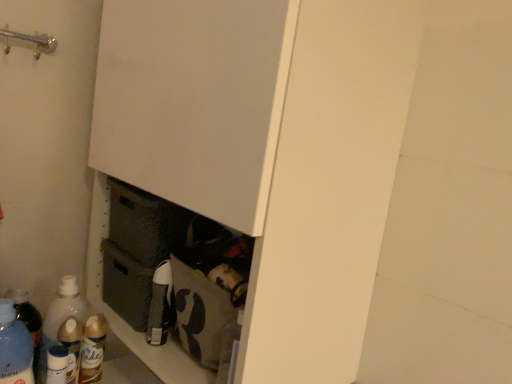
Question: From a real-world perspective, is translucent plastic bottle at lower left, positioned as the first bottle in left-to-right order, under matte gray cabinet at center?

Choices:
 (A) yes
 (B) no

Answer: (A)

Question: Are translucent plastic bottle at lower left, which ranks as the 5th bottle in right-to-left order, and matte gray cabinet at center far apart?

Choices:
 (A) yes
 (B) no

Answer: (B)

Question: Considering the relative positions of translucent plastic bottle at lower left, positioned as the first bottle in left-to-right order, and matte gray cabinet at center in the image provided, is translucent plastic bottle at lower left, positioned as the first bottle in left-to-right order, to the left of matte gray cabinet at center from the viewer's perspective?

Choices:
 (A) yes
 (B) no

Answer: (A)

Question: Can you confirm if translucent plastic bottle at lower left, which ranks as the 5th bottle in right-to-left order, is taller than matte gray cabinet at center?

Choices:
 (A) no
 (B) yes

Answer: (B)

Question: Is matte gray cabinet at center a part of translucent plastic bottle at lower left, which ranks as the 5th bottle in right-to-left order?

Choices:
 (A) yes
 (B) no

Answer: (B)

Question: Is translucent plastic bottle at lower left, positioned as the first bottle in left-to-right order, in contact with matte gray cabinet at center?

Choices:
 (A) no
 (B) yes

Answer: (A)

Question: Can you confirm if translucent plastic bottle at lower left, acting as the 3th bottle starting from the left, is positioned to the left of translucent plastic bottle at lower left, positioned as the second bottle in left-to-right order?

Choices:
 (A) yes
 (B) no

Answer: (B)

Question: Is translucent plastic bottle at lower left, acting as the 3th bottle starting from the left, far from translucent plastic bottle at lower left, the fourth bottle positioned from the right?

Choices:
 (A) yes
 (B) no

Answer: (B)

Question: From a real-world perspective, is translucent plastic bottle at lower left, acting as the 3th bottle starting from the left, physically below translucent plastic bottle at lower left, positioned as the second bottle in left-to-right order?

Choices:
 (A) no
 (B) yes

Answer: (B)

Question: Considering the relative sizes of translucent plastic bottle at lower left, acting as the 3th bottle starting from the left, and translucent plastic bottle at lower left, the fourth bottle positioned from the right, in the image provided, is translucent plastic bottle at lower left, acting as the 3th bottle starting from the left, thinner than translucent plastic bottle at lower left, the fourth bottle positioned from the right,?

Choices:
 (A) yes
 (B) no

Answer: (A)

Question: Can you confirm if translucent plastic bottle at lower left, the 3th bottle when ordered from right to left, is smaller than translucent plastic bottle at lower left, the fourth bottle positioned from the right?

Choices:
 (A) yes
 (B) no

Answer: (A)

Question: Would you say translucent plastic bottle at lower left, positioned as the second bottle in left-to-right order, is part of translucent plastic bottle at lower left, acting as the 3th bottle starting from the left,'s contents?

Choices:
 (A) no
 (B) yes

Answer: (A)

Question: From the image's perspective, is brushed metal door handle at upper left located above white matte cupboard at center?

Choices:
 (A) yes
 (B) no

Answer: (A)